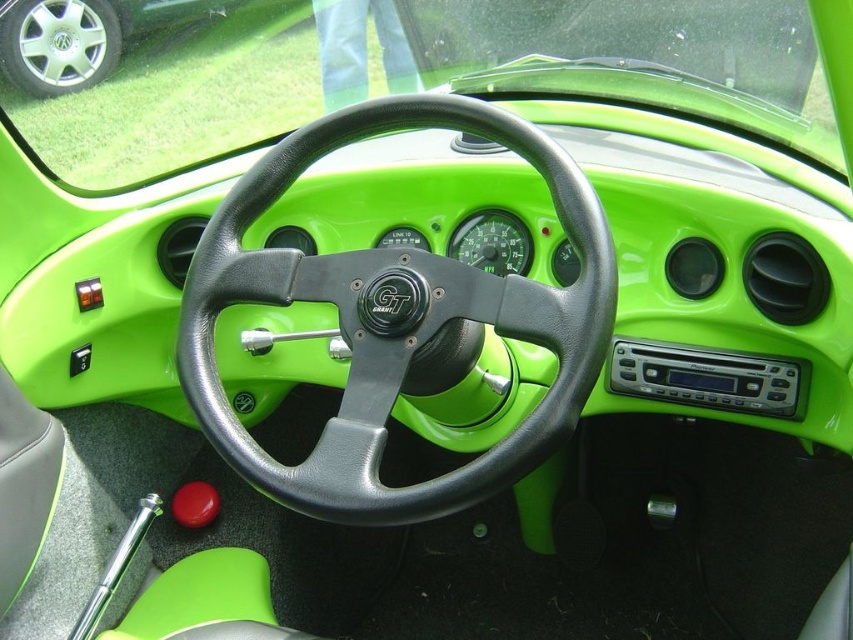
Is black leather steering wheel at center bigger than silver metallic wheel at upper left?

Yes, black leather steering wheel at center is bigger than silver metallic wheel at upper left.

Is point (537, 429) positioned in front of point (88, 32)?

Yes.

Identify the location of black leather steering wheel at center. (396, 320).